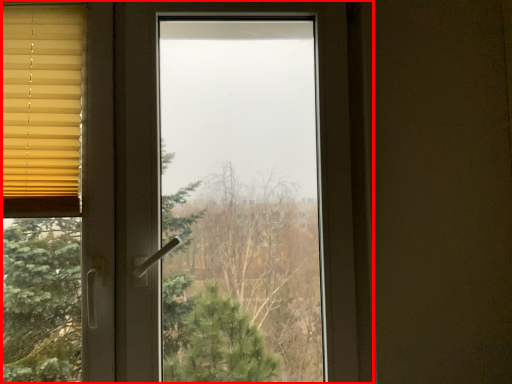
Question: From the image's perspective, where is window (annotated by the red box) located in relation to window blind in the image?

Choices:
 (A) above
 (B) below

Answer: (B)